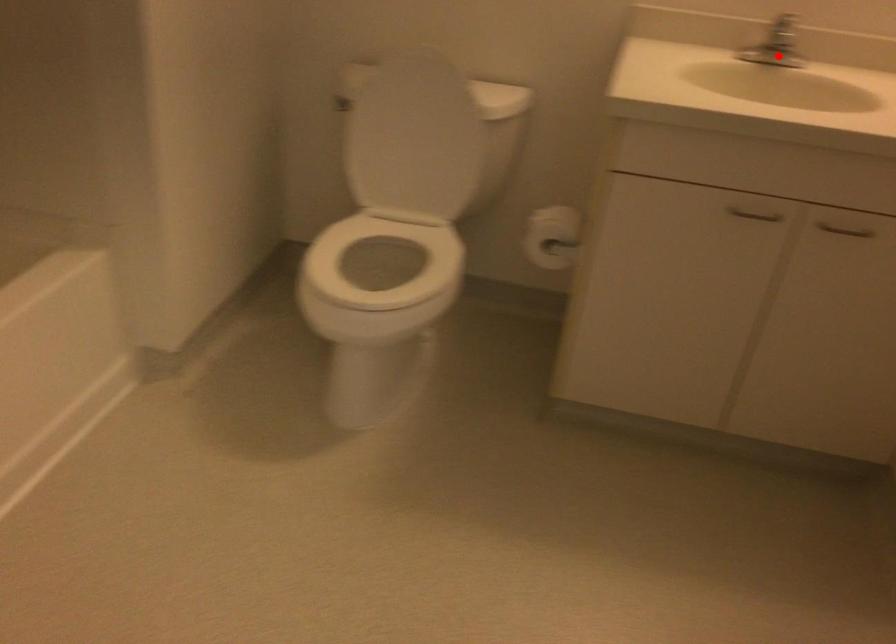
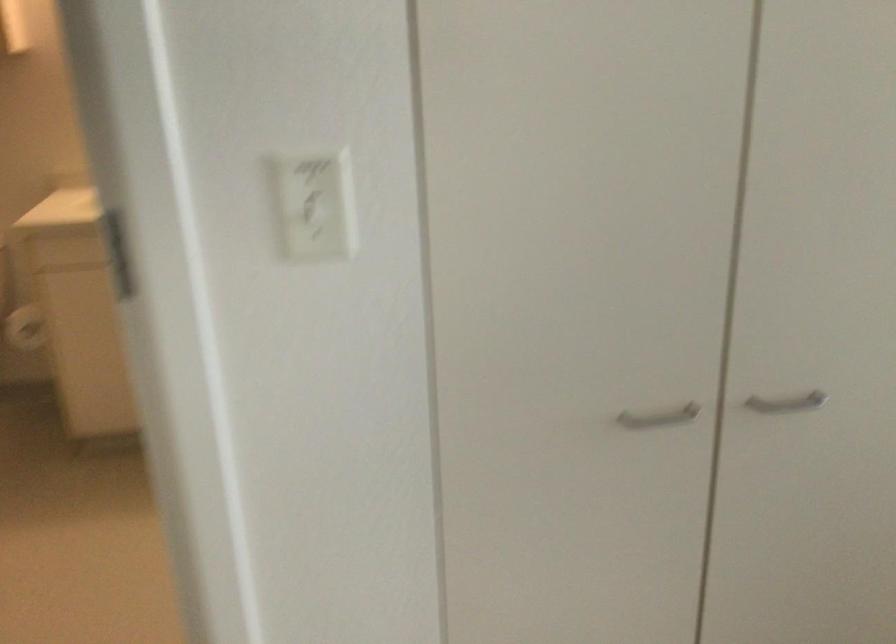
Question: I am providing you with two images of the same scene from different viewpoints. A red point is marked on the first image. At the location where the point appears in image 1, is it still visible in image 2?

Choices:
 (A) Yes
 (B) No

Answer: (B)